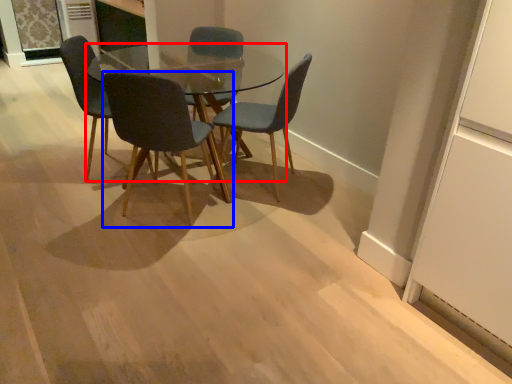
Question: Which object is closer to the camera taking this photo, coffee table (highlighted by a red box) or chair (highlighted by a blue box)?

Choices:
 (A) coffee table
 (B) chair

Answer: (B)